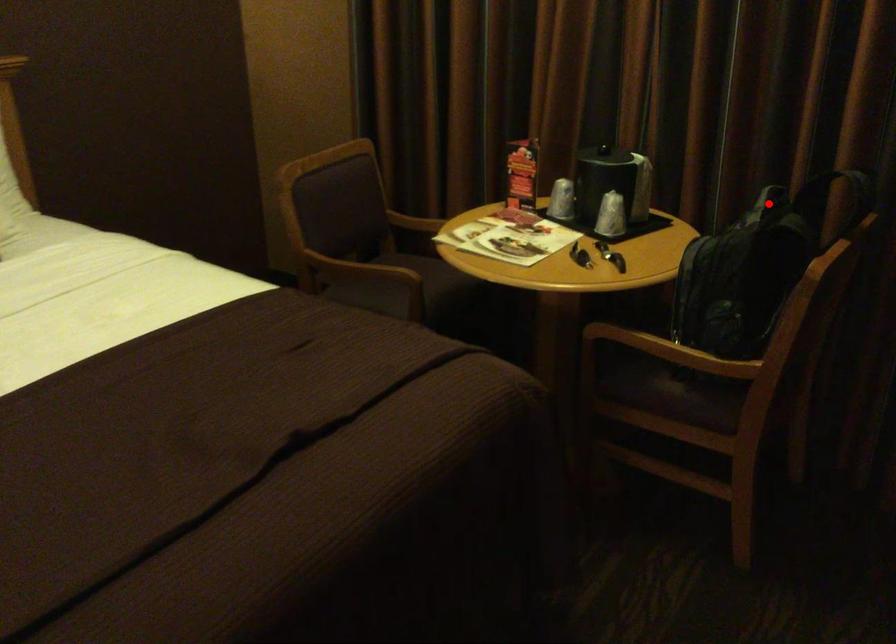
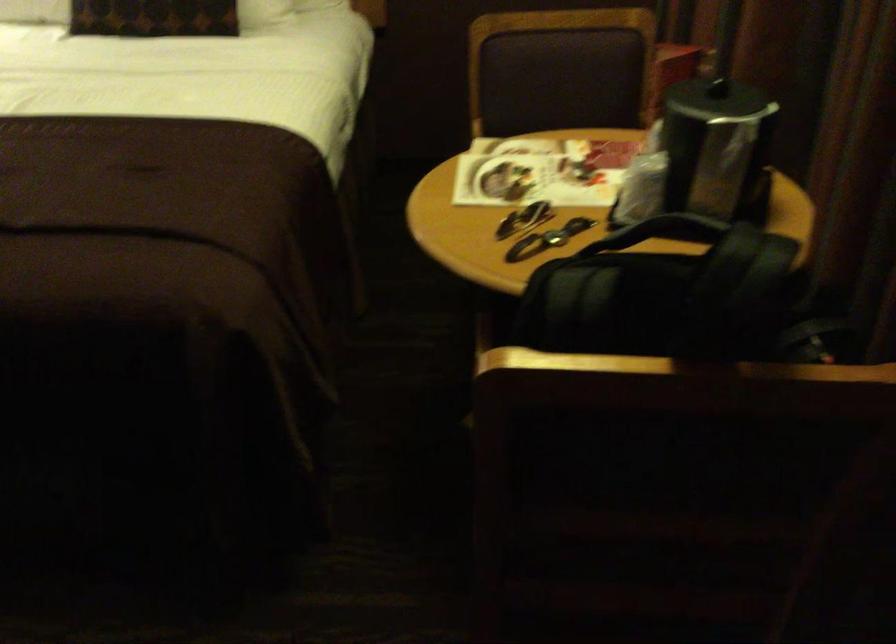
Question: I am providing you with two images of the same scene from different viewpoints. In image1, a red point is highlighted. Considering the same 3D point in image2, which of the following is correct?

Choices:
 (A) It is closer
 (B) It is farther

Answer: (A)